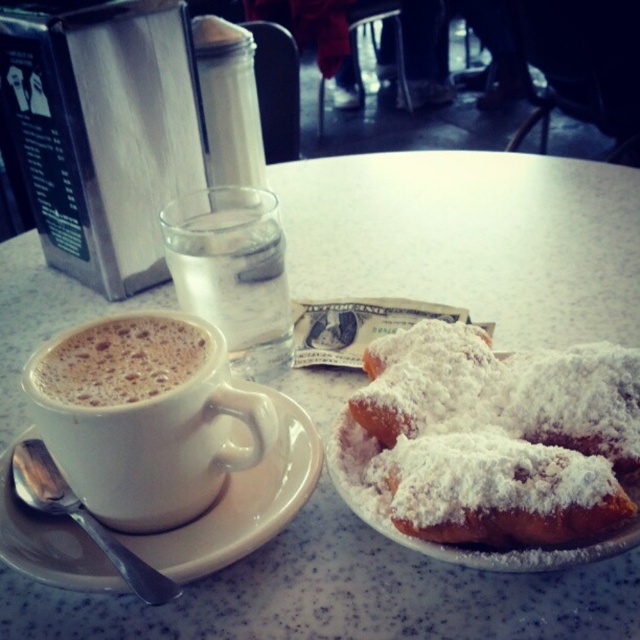
Question: Which point is farther to the camera?

Choices:
 (A) powdery golden pastry at lower right
 (B) white matte cup at left
 (C) clear glass water at upper center
 (D) white ceramic saucer at left

Answer: (C)

Question: Which object is positioned closest to the white matte cup at left?

Choices:
 (A) powdery golden pastry at lower right
 (B) white frothy coffee at upper left
 (C) clear glass water at upper center

Answer: (B)

Question: Does powdery golden pastry at lower right appear over white matte cup at left?

Choices:
 (A) yes
 (B) no

Answer: (B)

Question: Among these points, which one is farthest from the camera?

Choices:
 (A) (60, 365)
 (B) (168, 413)

Answer: (A)

Question: From the image, what is the correct spatial relationship of white matte cup at left in relation to white ceramic saucer at left?

Choices:
 (A) above
 (B) below

Answer: (A)

Question: Does clear glass water at upper center have a lesser width compared to white frothy coffee at upper left?

Choices:
 (A) yes
 (B) no

Answer: (B)